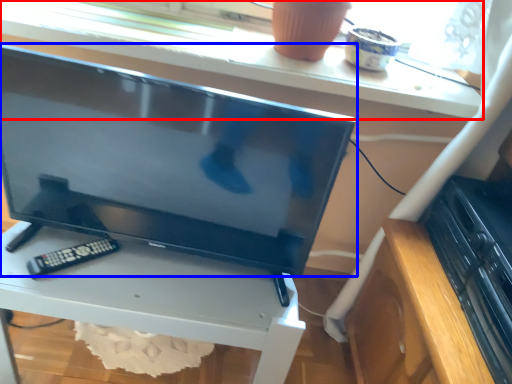
Question: Among these objects, which one is farthest to the camera, window sill (highlighted by a red box) or television (highlighted by a blue box)?

Choices:
 (A) window sill
 (B) television

Answer: (A)